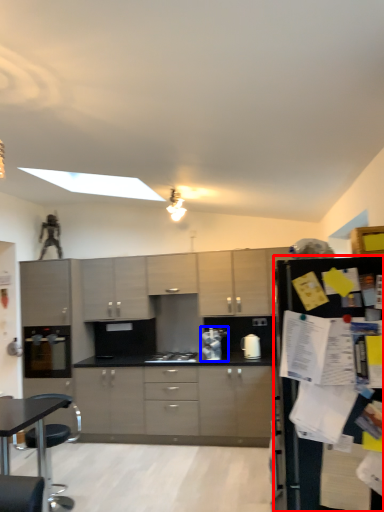
Question: Among these objects, which one is farthest to the camera, refrigerator (highlighted by a red box) or appliance (highlighted by a blue box)?

Choices:
 (A) refrigerator
 (B) appliance

Answer: (B)